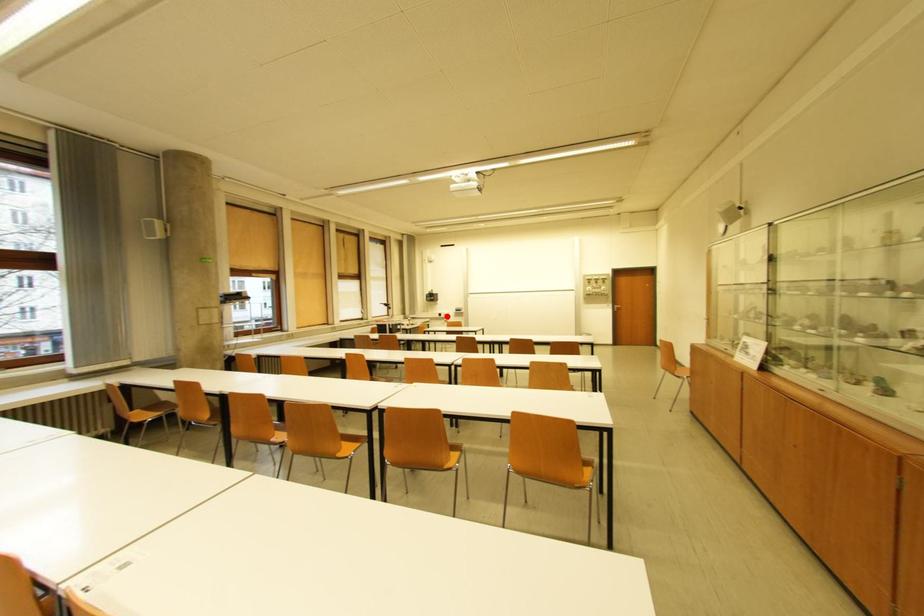
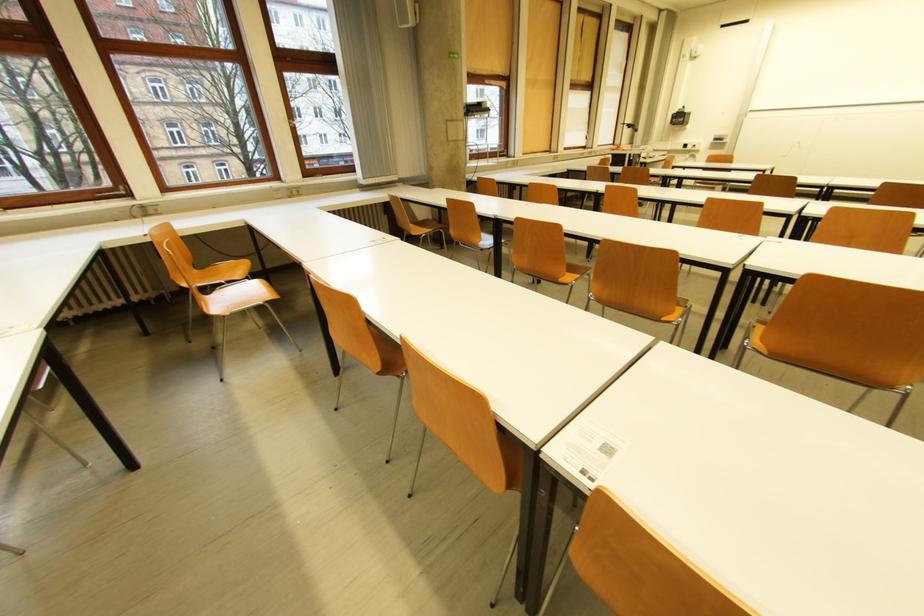
Question: I am providing you with two images of the same scene from different viewpoints. Image1 has a red point marked. In image2, the corresponding 3D location appears at what relative position? Reply with the corresponding letter.

Choices:
 (A) Closer
 (B) Farther

Answer: (A)